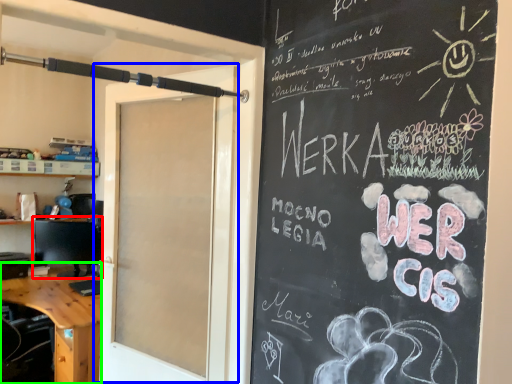
Question: Considering the real-world distances, which object is closest to computer monitor (highlighted by a red box)? door (highlighted by a blue box) or desk (highlighted by a green box).

Choices:
 (A) door
 (B) desk

Answer: (B)